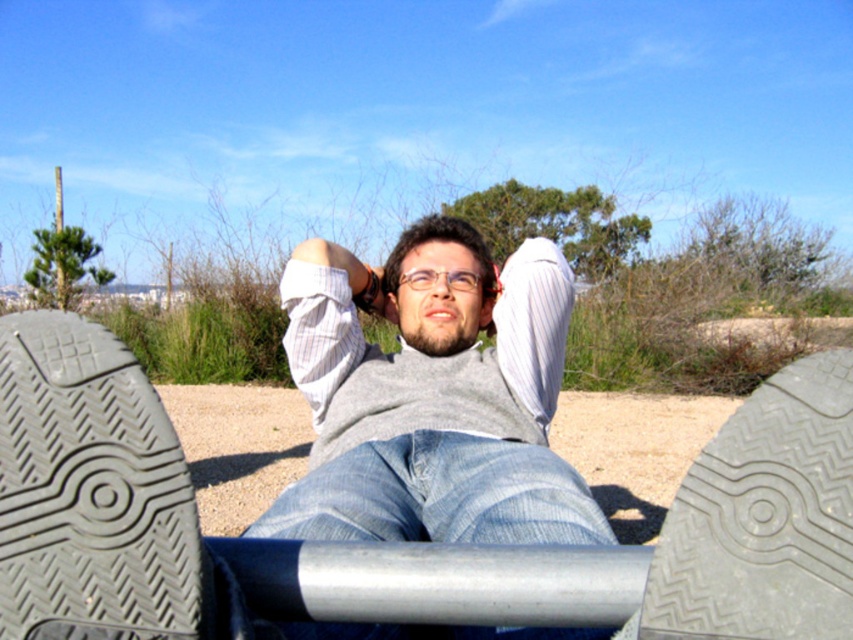
Between gray sweater at center and green metallic pole at upper left, which one appears on the right side from the viewer's perspective?

From the viewer's perspective, gray sweater at center appears more on the right side.

Does gray sweater at center have a greater height compared to green metallic pole at upper left?

Indeed, gray sweater at center has a greater height compared to green metallic pole at upper left.

The width and height of the screenshot is (853, 640). What do you see at coordinates (432, 396) in the screenshot?
I see `gray sweater at center` at bounding box center [432, 396].

You are a GUI agent. You are given a task and a screenshot of the screen. Output one action in this format:
    pyautogui.click(x=<x>, y=<y>)
    Task: Click on the gray sweater at center
    This screenshot has width=853, height=640.
    Given the screenshot: What is the action you would take?
    pyautogui.click(x=432, y=396)

Which is in front, point (103, 346) or point (805, 426)?

Positioned in front is point (805, 426).

Is point (119, 608) closer to viewer compared to point (788, 392)?

Yes.

Is point (161, 529) less distant than point (846, 380)?

That is False.

This screenshot has height=640, width=853. I want to click on black rubber shoe at lower left, so click(x=90, y=490).

Which is more to the left, gray sweater at center or denim at center?

Positioned to the left is denim at center.

Is point (549, 324) positioned after point (447, 472)?

Yes.

Who is more forward, (490, 374) or (498, 445)?

Point (498, 445)

In order to click on gray sweater at center in this screenshot , I will do `click(432, 396)`.